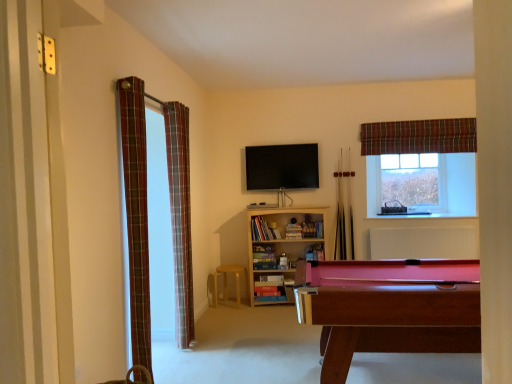
Locate an element on the screen. vacant area that is situated to the right of plaid fabric curtain at left, acting as the 2th curtain starting from the back is located at coordinates (214, 336).